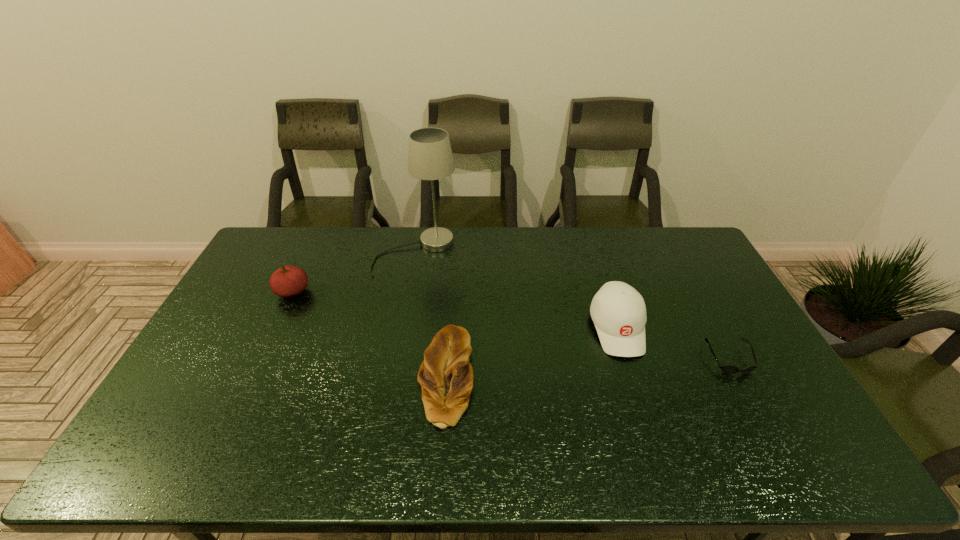
The height and width of the screenshot is (540, 960). What are the coordinates of `free space located on the front of the fourth tallest object` in the screenshot? It's located at (441, 454).

The image size is (960, 540). In order to click on vacant area situated 0.240m on the lenses of the sunglasses in this screenshot , I will do `click(782, 460)`.

The width and height of the screenshot is (960, 540). I want to click on object that is at the far edge, so click(430, 157).

I want to click on object that is positioned at the left edge, so click(x=287, y=281).

In order to click on object situated at the right edge in this screenshot , I will do `click(729, 369)`.

In the image, there is a desktop. In order to click on vacant space at the far edge in this screenshot , I will do `click(349, 247)`.

The image size is (960, 540). Find the location of `vacant space at the near edge`. vacant space at the near edge is located at coordinates (617, 464).

Identify the location of vacant point at the left edge. The height and width of the screenshot is (540, 960). (238, 304).

Locate an element on the screen. The width and height of the screenshot is (960, 540). free region at the right edge is located at coordinates (693, 299).

Locate an element on the screen. free space at the far left corner of the desktop is located at coordinates (275, 246).